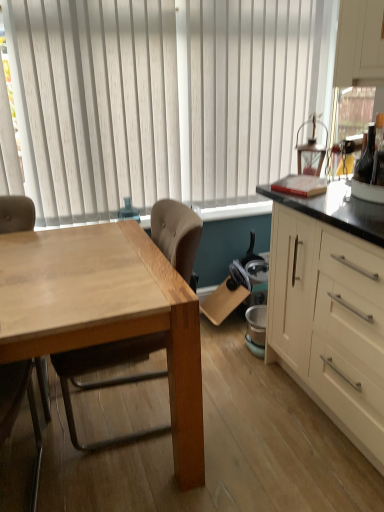
Question: Would you say white matte cabinet at right is outside light brown wood chair at left, acting as the first chair starting from the right?

Choices:
 (A) no
 (B) yes

Answer: (B)

Question: From a real-world perspective, is white matte cabinet at right physically above light brown wood chair at left, acting as the 2th chair starting from the left?

Choices:
 (A) no
 (B) yes

Answer: (B)

Question: Is white matte cabinet at right at the right side of light brown wood chair at left, acting as the 2th chair starting from the left?

Choices:
 (A) no
 (B) yes

Answer: (B)

Question: Can you confirm if white matte cabinet at right is taller than light brown wood chair at left, acting as the 2th chair starting from the left?

Choices:
 (A) no
 (B) yes

Answer: (B)

Question: Can you confirm if white matte cabinet at right is wider than light brown wood chair at left, acting as the 2th chair starting from the left?

Choices:
 (A) no
 (B) yes

Answer: (B)

Question: Based on their sizes in the image, would you say white vertical blinds at upper center is bigger or smaller than white matte cabinet at right?

Choices:
 (A) big
 (B) small

Answer: (B)

Question: Does point click(170, 151) appear closer or farther from the camera than point click(271, 350)?

Choices:
 (A) farther
 (B) closer

Answer: (A)

Question: Considering the relative positions of white vertical blinds at upper center and white matte cabinet at right in the image provided, is white vertical blinds at upper center to the left or to the right of white matte cabinet at right?

Choices:
 (A) left
 (B) right

Answer: (A)

Question: In terms of height, does white vertical blinds at upper center look taller or shorter compared to white matte cabinet at right?

Choices:
 (A) short
 (B) tall

Answer: (B)

Question: Looking at their shapes, would you say white matte cabinet at right is wider or thinner than white vertical blinds at upper center?

Choices:
 (A) thin
 (B) wide

Answer: (B)

Question: Does point (331, 208) appear closer or farther from the camera than point (288, 45)?

Choices:
 (A) farther
 (B) closer

Answer: (B)

Question: Would you say white matte cabinet at right is inside or outside white vertical blinds at upper center?

Choices:
 (A) outside
 (B) inside

Answer: (A)

Question: In terms of height, does white matte cabinet at right look taller or shorter compared to white vertical blinds at upper center?

Choices:
 (A) tall
 (B) short

Answer: (B)

Question: Is white vertical blinds at upper center inside or outside of light brown wood chair at left, which is the 1th chair in left-to-right order?

Choices:
 (A) inside
 (B) outside

Answer: (B)

Question: From the image's perspective, is white vertical blinds at upper center positioned above or below light brown wood chair at left, which is the 1th chair in left-to-right order?

Choices:
 (A) above
 (B) below

Answer: (A)